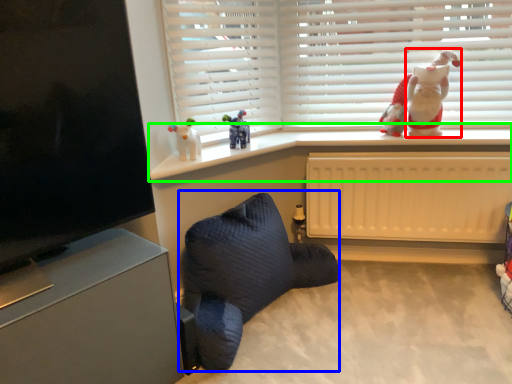
Question: Which is farther away from santa claus (highlighted by a red box)? bean bag chair (highlighted by a blue box) or window sill (highlighted by a green box)?

Choices:
 (A) bean bag chair
 (B) window sill

Answer: (A)